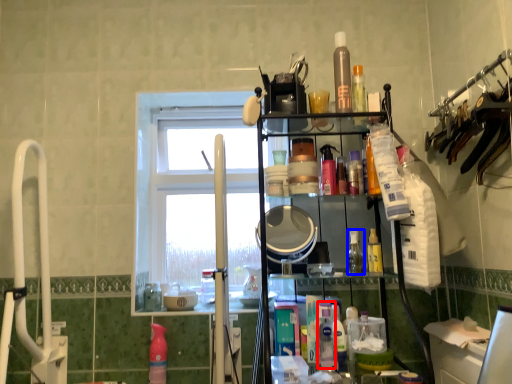
Question: Among these objects, which one is nearest to the camera, cleaning product (highlighted by a red box) or toiletry (highlighted by a blue box)?

Choices:
 (A) cleaning product
 (B) toiletry

Answer: (A)